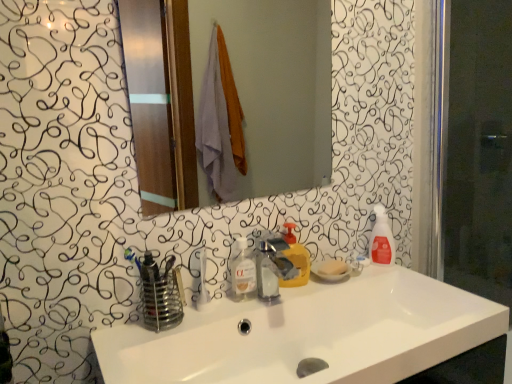
Image resolution: width=512 pixels, height=384 pixels. Identify the location of vacant position to the left of clear liquid soap at center. (175, 317).